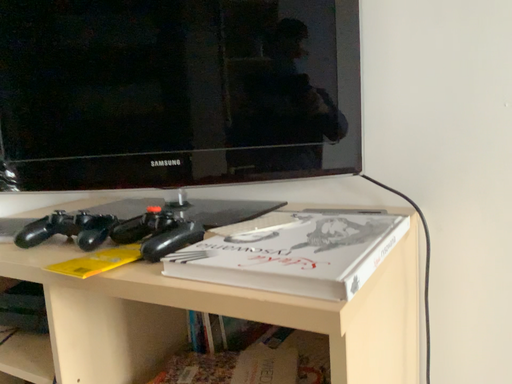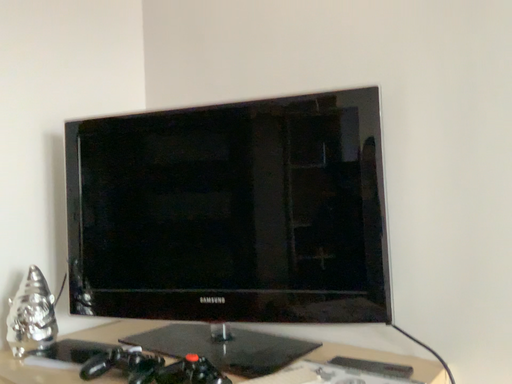
Question: How did the camera likely rotate when shooting the video?

Choices:
 (A) rotated upward
 (B) rotated downward

Answer: (A)